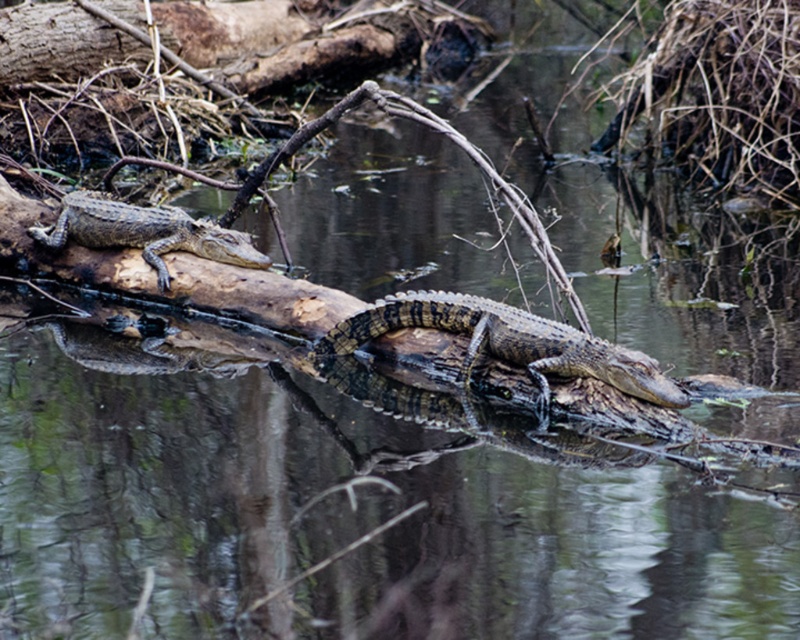
Question: Observing the image, what is the correct spatial positioning of shiny brown crocodile at center in reference to shiny brown crocodile at upper left?

Choices:
 (A) above
 (B) below

Answer: (B)

Question: Does shiny brown crocodile at center have a lesser width compared to shiny brown crocodile at upper left?

Choices:
 (A) yes
 (B) no

Answer: (B)

Question: In this image, where is shiny brown crocodile at center located relative to shiny brown crocodile at upper left?

Choices:
 (A) left
 (B) right

Answer: (B)

Question: Which point is closer to the camera taking this photo?

Choices:
 (A) (604, 349)
 (B) (244, 241)

Answer: (A)

Question: Which point is closer to the camera?

Choices:
 (A) shiny brown crocodile at center
 (B) shiny brown crocodile at upper left

Answer: (A)